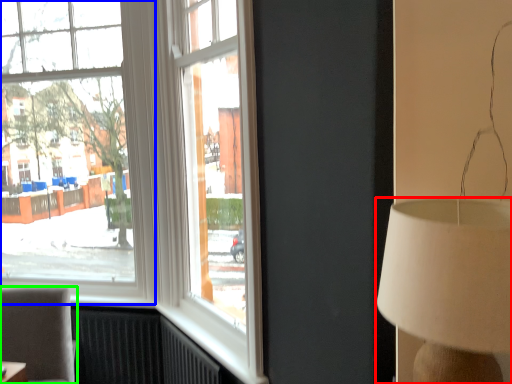
Question: Estimate the real-world distances between objects in this image. Which object is closer to lamp (highlighted by a red box), window (highlighted by a blue box) or furniture (highlighted by a green box)?

Choices:
 (A) window
 (B) furniture

Answer: (B)